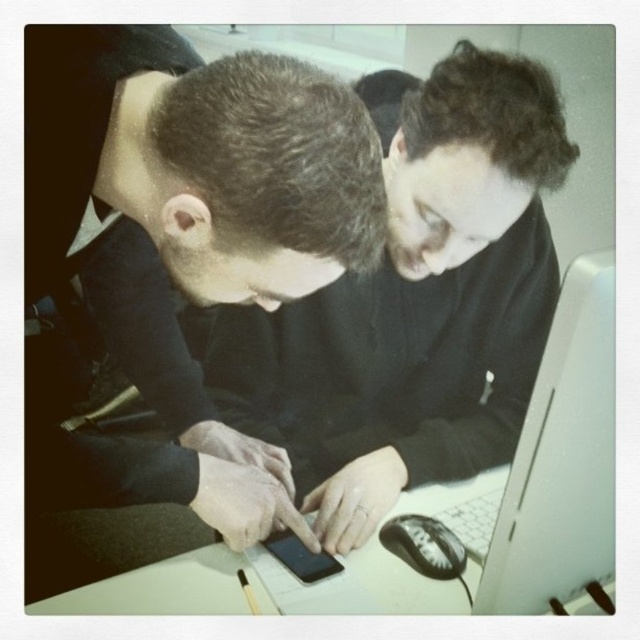
You are organizing items on a desk and need to place a matte black phone at center and a black plastic mouse at lower center. According to the scene, which item is positioned to the left of the other?

The matte black phone at center is to the left of black plastic mouse at lower center.

You are a person with a height of 1.7 meters standing at the desk. The matte black phone at center is placed on the desk. If you want to pick up the phone without moving your feet, can you reach it?

The matte black phone at center is 52.29 centimeters away from the viewer. Since the average arm length for a person of 1.7 meters is around 70 centimeters, you can comfortably reach the matte black phone at center without moving your feet.

You are a delivery robot with a package that needs to be placed between the white glossy laptop at center and the white plastic keyboard at lower right. The package is 8 inches long. Will it fit in the space between them?

The white glossy laptop at center is 7.63 inches away from the white plastic keyboard at lower right. Since the package is 8 inches long, it will not fit in the space between them as the distance is slightly less than the package length.